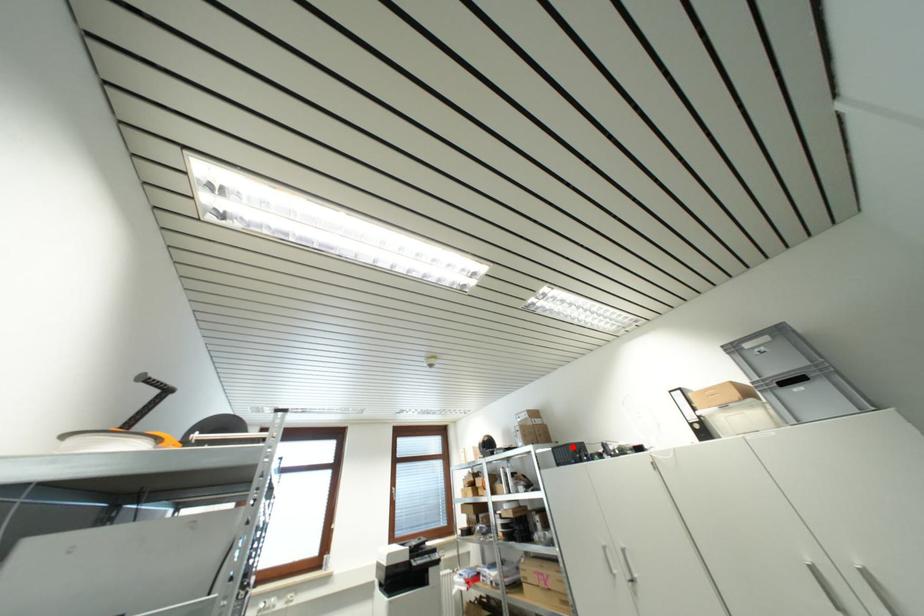
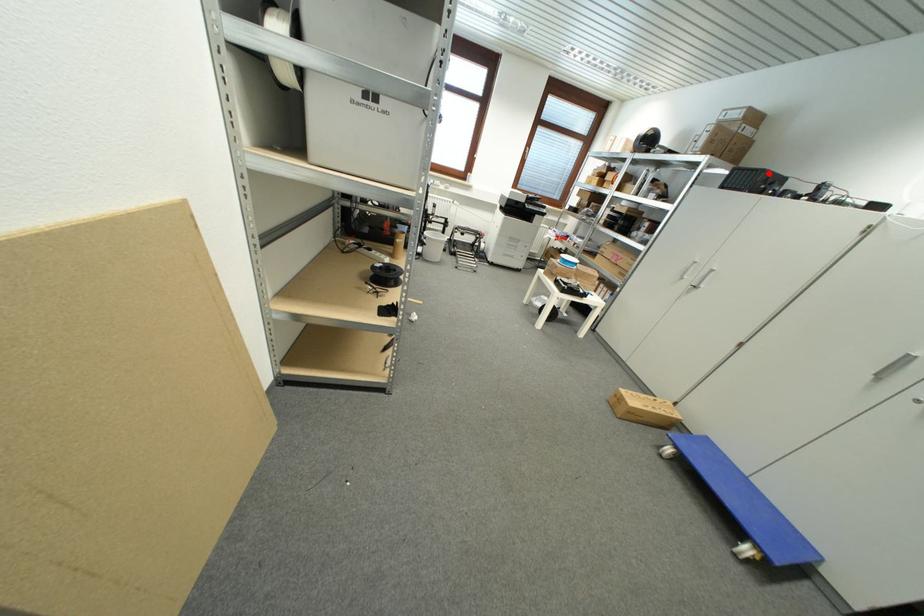
I am providing you with two images of the same scene from different viewpoints. A red point is marked on the first image and another point is marked on the second image. Does the point marked in image1 correspond to the same location as the one in image2?

Yes